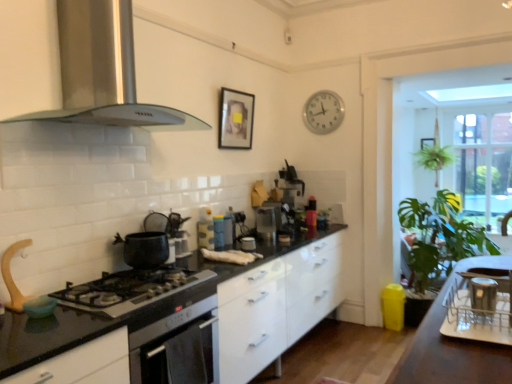
Question: Is silver metallic clock at upper center next to stainless steel range hood at upper left, which is the first kitchen appliance in top-to-bottom order, and touching it?

Choices:
 (A) no
 (B) yes

Answer: (A)

Question: From a real-world perspective, is silver metallic clock at upper center on top of stainless steel range hood at upper left, which is the first kitchen appliance in top-to-bottom order?

Choices:
 (A) yes
 (B) no

Answer: (B)

Question: Does silver metallic clock at upper center have a greater height compared to stainless steel range hood at upper left, which is the first kitchen appliance in top-to-bottom order?

Choices:
 (A) no
 (B) yes

Answer: (A)

Question: Does silver metallic clock at upper center have a lesser width compared to stainless steel range hood at upper left, which is the second kitchen appliance in bottom-to-top order?

Choices:
 (A) yes
 (B) no

Answer: (A)

Question: From the image's perspective, is silver metallic clock at upper center on stainless steel range hood at upper left, which is the second kitchen appliance in bottom-to-top order?

Choices:
 (A) yes
 (B) no

Answer: (A)

Question: From the image's perspective, relative to black glossy countertop at center, is silver metallic clock at upper center above or below?

Choices:
 (A) below
 (B) above

Answer: (B)

Question: Considering the positions of silver metallic clock at upper center and black glossy countertop at center in the image, is silver metallic clock at upper center wider or thinner than black glossy countertop at center?

Choices:
 (A) wide
 (B) thin

Answer: (B)

Question: Which is correct: silver metallic clock at upper center is inside black glossy countertop at center, or outside of it?

Choices:
 (A) inside
 (B) outside

Answer: (B)

Question: From a real-world perspective, is silver metallic clock at upper center positioned above or below black glossy countertop at center?

Choices:
 (A) below
 (B) above

Answer: (B)

Question: Is point (470, 195) positioned closer to the camera than point (124, 283)?

Choices:
 (A) farther
 (B) closer

Answer: (A)

Question: Is clear glass window at right taller or shorter than black matte gas stove at center?

Choices:
 (A) short
 (B) tall

Answer: (B)

Question: Is clear glass window at right to the left or to the right of black matte gas stove at center in the image?

Choices:
 (A) left
 (B) right

Answer: (B)

Question: Is clear glass window at right situated inside black matte gas stove at center or outside?

Choices:
 (A) inside
 (B) outside

Answer: (B)

Question: Do you think matte blue thermos at center, acting as the fifth appliance starting from the right, is within clear glass window at right, or outside of it?

Choices:
 (A) inside
 (B) outside

Answer: (B)

Question: Looking at their shapes, would you say matte blue thermos at center, which appears as the 2th appliance when viewed from the back, is wider or thinner than clear glass window at right?

Choices:
 (A) thin
 (B) wide

Answer: (A)